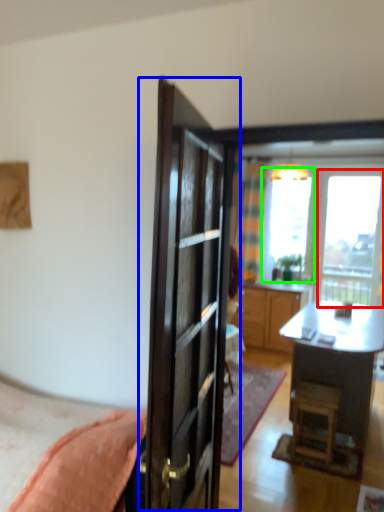
Question: Based on their relative distances, which object is nearer to window (highlighted by a red box)? Choose from door (highlighted by a blue box) and window screen (highlighted by a green box).

Choices:
 (A) door
 (B) window screen

Answer: (B)